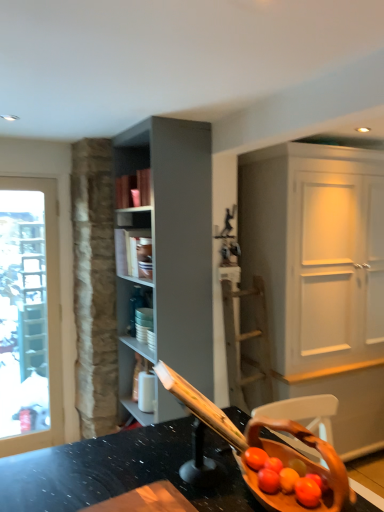
Question: From their relative heights in the image, would you say white matte cabinet at right is taller or shorter than matte gray shelf at center?

Choices:
 (A) short
 (B) tall

Answer: (B)

Question: Does point (271, 207) appear closer or farther from the camera than point (124, 241)?

Choices:
 (A) farther
 (B) closer

Answer: (B)

Question: Considering the positions of white matte cabinet at right and matte gray shelf at center in the image, is white matte cabinet at right bigger or smaller than matte gray shelf at center?

Choices:
 (A) small
 (B) big

Answer: (B)

Question: Visually, is matte gray shelf at center positioned to the left or to the right of white matte cabinet at right?

Choices:
 (A) right
 (B) left

Answer: (B)

Question: Is matte gray shelf at center bigger or smaller than white matte cabinet at right?

Choices:
 (A) big
 (B) small

Answer: (B)

Question: From a real-world perspective, is matte gray shelf at center above or below white matte cabinet at right?

Choices:
 (A) below
 (B) above

Answer: (B)

Question: Is matte gray shelf at center in front of or behind white matte cabinet at right in the image?

Choices:
 (A) behind
 (B) front

Answer: (A)